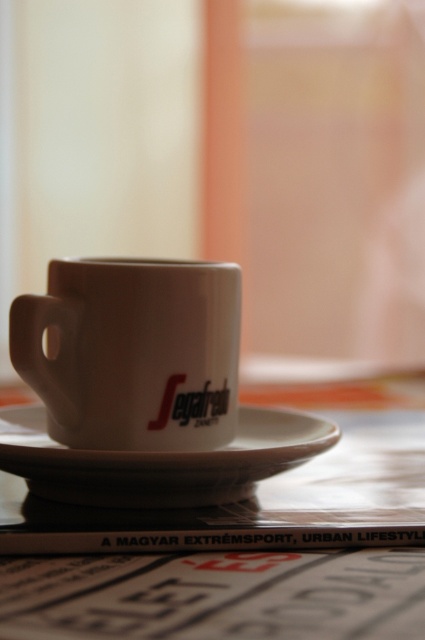
Can you confirm if white matte mug at center is wider than white ceramic saucer at center?

In fact, white matte mug at center might be narrower than white ceramic saucer at center.

Between white matte mug at center and white ceramic saucer at center, which one has more height?

With more height is white matte mug at center.

Between point (62, 320) and point (113, 490), which one is positioned behind?

Point (62, 320)

The image size is (425, 640). Find the location of `white matte mug at center`. white matte mug at center is located at coordinates (133, 353).

Which is below, white glossy table at center or white matte mug at center?

white glossy table at center is lower down.

Which is in front, point (408, 474) or point (218, 314)?

Positioned in front is point (218, 314).

Between point (56, 544) and point (212, 394), which one is positioned in front?

Positioned in front is point (56, 544).

Where is `white glossy table at center`? Image resolution: width=425 pixels, height=640 pixels. white glossy table at center is located at coordinates (249, 541).

You are a GUI agent. You are given a task and a screenshot of the screen. Output one action in this format:
    pyautogui.click(x=<x>, y=<y>)
    Task: Click on the white glossy table at center
    
    Given the screenshot: What is the action you would take?
    pyautogui.click(x=249, y=541)

Does white glossy table at center appear on the right side of white ceramic saucer at center?

Yes, white glossy table at center is to the right of white ceramic saucer at center.

In order to click on white glossy table at center in this screenshot , I will do `click(249, 541)`.

Locate an element on the screen. The width and height of the screenshot is (425, 640). white glossy table at center is located at coordinates (249, 541).